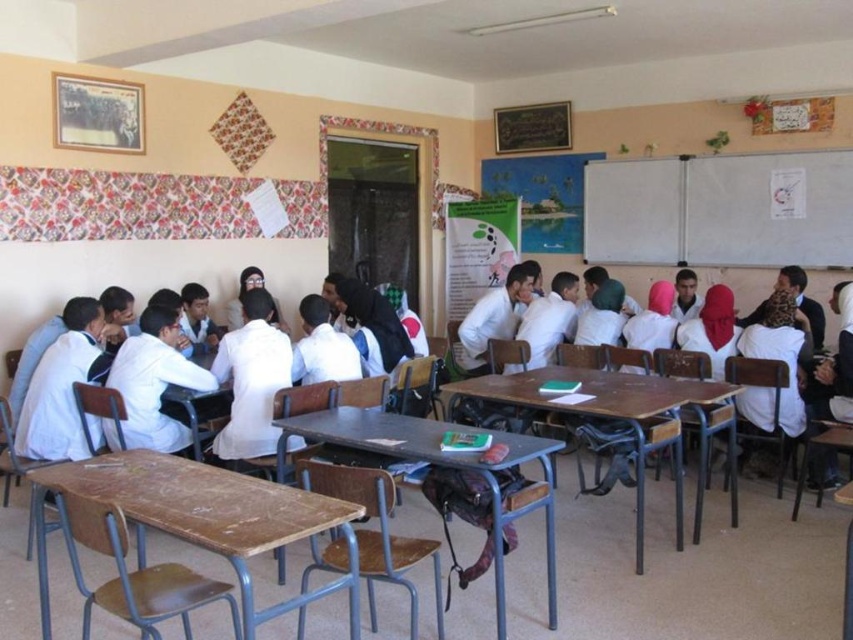
Is point (376, 349) positioned in front of point (531, 282)?

Yes, it is in front of point (531, 282).

Can you confirm if white matte uniform at center is shorter than white matte coat at center?

Yes.

Which is in front, point (331, 301) or point (494, 312)?

Positioned in front is point (331, 301).

Find the location of a particular element. The height and width of the screenshot is (640, 853). white matte uniform at center is located at coordinates (369, 323).

Is wooden desk at lower left in front of wooden table at center?

That is True.

Measure the distance between wooden desk at lower left and wooden table at center.

A distance of 5.62 feet exists between wooden desk at lower left and wooden table at center.

You are a GUI agent. You are given a task and a screenshot of the screen. Output one action in this format:
    pyautogui.click(x=<x>, y=<y>)
    Task: Click on the wooden desk at lower left
    This screenshot has width=853, height=640.
    Given the screenshot: What is the action you would take?
    pyautogui.click(x=206, y=518)

In the scene shown: Can you confirm if wooden desk at center is positioned to the left of white matte uniform at center?

In fact, wooden desk at center is to the right of white matte uniform at center.

Image resolution: width=853 pixels, height=640 pixels. In order to click on wooden desk at center in this screenshot , I will do `click(440, 465)`.

What do you see at coordinates (440, 465) in the screenshot? I see `wooden desk at center` at bounding box center [440, 465].

Locate an element on the screen. This screenshot has width=853, height=640. wooden desk at center is located at coordinates (440, 465).